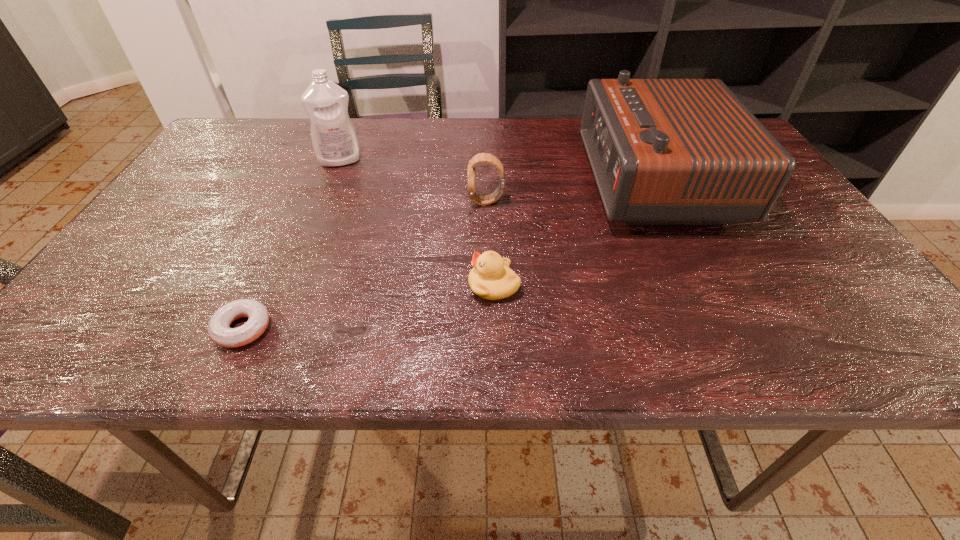
Find the location of `vacant space situated 0.390m on the tuning display of the radio receiver`. vacant space situated 0.390m on the tuning display of the radio receiver is located at coordinates (429, 183).

Find the location of a particular element. Image resolution: width=960 pixels, height=540 pixels. vacant space located on the face of the watch is located at coordinates (370, 201).

Image resolution: width=960 pixels, height=540 pixels. Find the location of `free location located 0.400m on the face of the watch`. free location located 0.400m on the face of the watch is located at coordinates (297, 201).

The image size is (960, 540). What are the coordinates of `vacant space located on the face of the watch` in the screenshot? It's located at tap(392, 201).

Locate an element on the screen. free region located 0.110m on the front-facing side of the duckling is located at coordinates (411, 286).

This screenshot has width=960, height=540. I want to click on vacant space located on the front-facing side of the duckling, so click(x=300, y=286).

What are the coordinates of `free space located on the front-facing side of the duckling` in the screenshot? It's located at (259, 286).

The image size is (960, 540). I want to click on free space located on the left of the shortest object, so click(x=134, y=328).

Identify the location of detergent located at the far edge. This screenshot has width=960, height=540. (334, 139).

Find the location of a particular element. radio receiver that is positioned at the far edge is located at coordinates (663, 151).